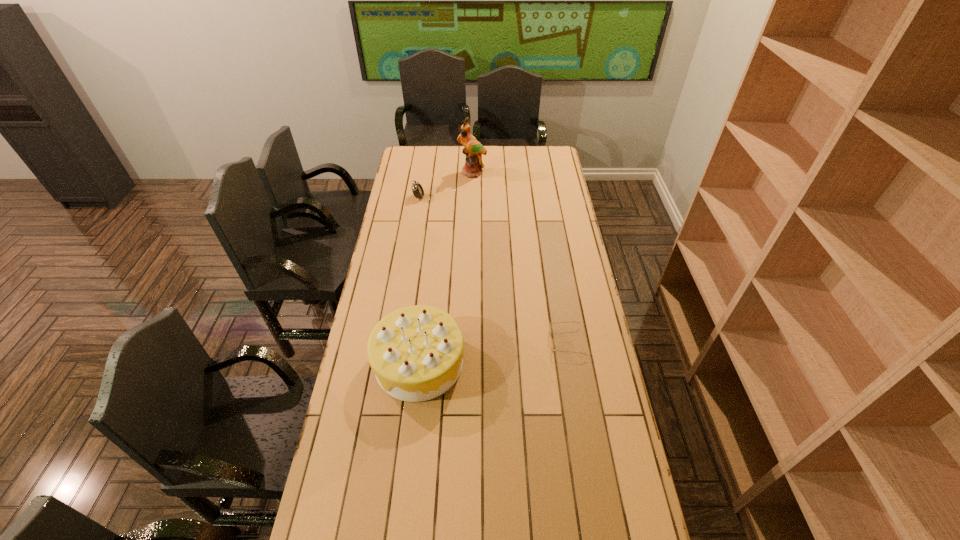
Locate an element on the screen. Image resolution: width=960 pixels, height=540 pixels. the farthest object is located at coordinates (473, 149).

Identify the location of parrot. (473, 149).

Find the location of a particular element. the third shortest object is located at coordinates (416, 353).

Identify the location of the second shortest object. (417, 189).

The image size is (960, 540). I want to click on alarm clock, so click(417, 189).

Where is `spectacles`? Image resolution: width=960 pixels, height=540 pixels. spectacles is located at coordinates (550, 326).

Locate an element on the screen. The image size is (960, 540). the rightmost object is located at coordinates (550, 326).

The width and height of the screenshot is (960, 540). Find the location of `vacant space positioned on the front-facing side of the farthest object`. vacant space positioned on the front-facing side of the farthest object is located at coordinates (472, 212).

The height and width of the screenshot is (540, 960). What are the coordinates of `vacant region located 0.370m on the right of the second tallest object` in the screenshot? It's located at (567, 362).

In order to click on vacant space located on the face of the second shortest object in this screenshot , I will do `click(445, 197)`.